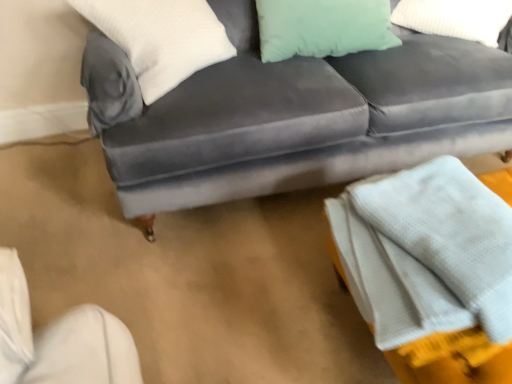
Question: Is velvet gray couch at center to the right of mint green fabric pillow at upper right, arranged as the 1th pillow when viewed from the right, from the viewer's perspective?

Choices:
 (A) yes
 (B) no

Answer: (B)

Question: Is velvet gray couch at center facing away from mint green fabric pillow at upper right, positioned as the 2th pillow in left-to-right order?

Choices:
 (A) yes
 (B) no

Answer: (A)

Question: Is velvet gray couch at center further to camera compared to mint green fabric pillow at upper right, arranged as the 1th pillow when viewed from the right?

Choices:
 (A) yes
 (B) no

Answer: (B)

Question: From a real-world perspective, is velvet gray couch at center below mint green fabric pillow at upper right, arranged as the 1th pillow when viewed from the right?

Choices:
 (A) yes
 (B) no

Answer: (A)

Question: Considering the relative positions of velvet gray couch at center and mint green fabric pillow at upper right, positioned as the 2th pillow in left-to-right order, in the image provided, is velvet gray couch at center in front of mint green fabric pillow at upper right, positioned as the 2th pillow in left-to-right order,?

Choices:
 (A) yes
 (B) no

Answer: (A)

Question: Considering the positions of point (x=429, y=178) and point (x=170, y=3), is point (x=429, y=178) closer or farther from the camera than point (x=170, y=3)?

Choices:
 (A) farther
 (B) closer

Answer: (B)

Question: From the image's perspective, is white textured blanket at lower right located above or below white soft pillow at upper left, which is the 1th pillow from left to right?

Choices:
 (A) below
 (B) above

Answer: (A)

Question: In the image, is white textured blanket at lower right positioned in front of or behind white soft pillow at upper left, which is the 1th pillow from left to right?

Choices:
 (A) front
 (B) behind

Answer: (A)

Question: From their relative heights in the image, would you say white textured blanket at lower right is taller or shorter than white soft pillow at upper left, which is the 2th pillow in right-to-left order?

Choices:
 (A) tall
 (B) short

Answer: (B)

Question: Do you think mint green fabric pillow at upper right, arranged as the 1th pillow when viewed from the right, is within white textured blanket at lower right, or outside of it?

Choices:
 (A) outside
 (B) inside

Answer: (A)

Question: Does point (414, 9) appear closer or farther from the camera than point (404, 236)?

Choices:
 (A) closer
 (B) farther

Answer: (B)

Question: Is mint green fabric pillow at upper right, arranged as the 1th pillow when viewed from the right, taller or shorter than white textured blanket at lower right?

Choices:
 (A) tall
 (B) short

Answer: (B)

Question: In the image, is mint green fabric pillow at upper right, positioned as the 2th pillow in left-to-right order, positioned in front of or behind white textured blanket at lower right?

Choices:
 (A) behind
 (B) front

Answer: (A)

Question: From the image's perspective, relative to white soft pillow at upper left, which is the 1th pillow from left to right, is mint green fabric pillow at upper right, positioned as the 2th pillow in left-to-right order, above or below?

Choices:
 (A) above
 (B) below

Answer: (A)

Question: Does point (453, 16) appear closer or farther from the camera than point (148, 94)?

Choices:
 (A) closer
 (B) farther

Answer: (B)